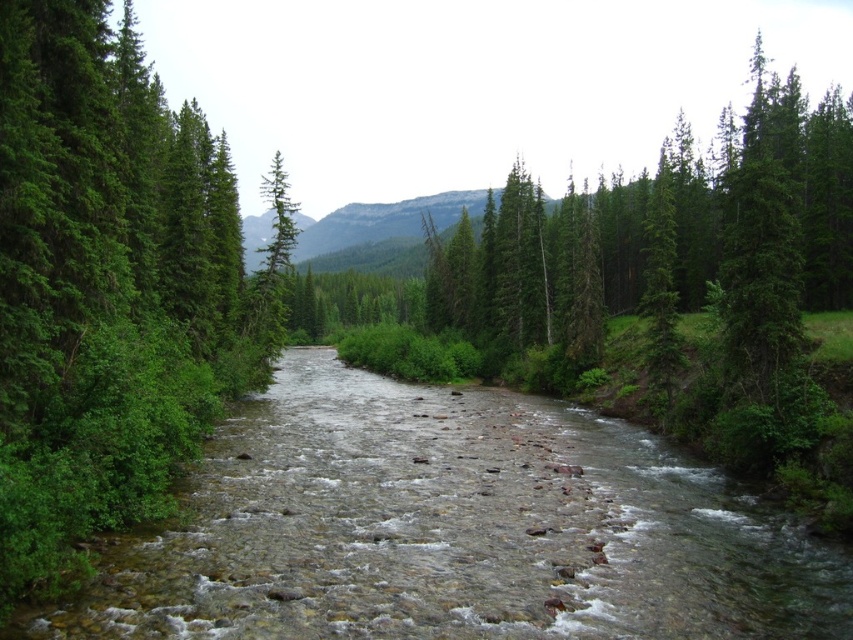
Does green leafy tree at left have a greater height compared to green matte evergreen tree at center?

Incorrect, green leafy tree at left's height is not larger of green matte evergreen tree at center's.

Is point (44, 209) more distant than point (277, 307)?

No, (44, 209) is in front of (277, 307).

This screenshot has height=640, width=853. Find the location of `green leafy tree at left`. green leafy tree at left is located at coordinates (106, 288).

Between green textured mountain at center and green matte evergreen tree at center, which one is positioned lower?

Positioned lower is green textured mountain at center.

Describe the element at coordinates (380, 230) in the screenshot. I see `green textured mountain at center` at that location.

The image size is (853, 640). I want to click on green textured mountain at center, so click(380, 230).

Which is below, clear stone stream at center or green matte evergreen tree at center?

clear stone stream at center is lower down.

Is point (86, 618) less distant than point (285, 234)?

Yes, point (86, 618) is in front of point (285, 234).

Does point (659, 593) come in front of point (279, 262)?

Yes, point (659, 593) is closer to viewer.

The image size is (853, 640). I want to click on clear stone stream at center, so click(456, 529).